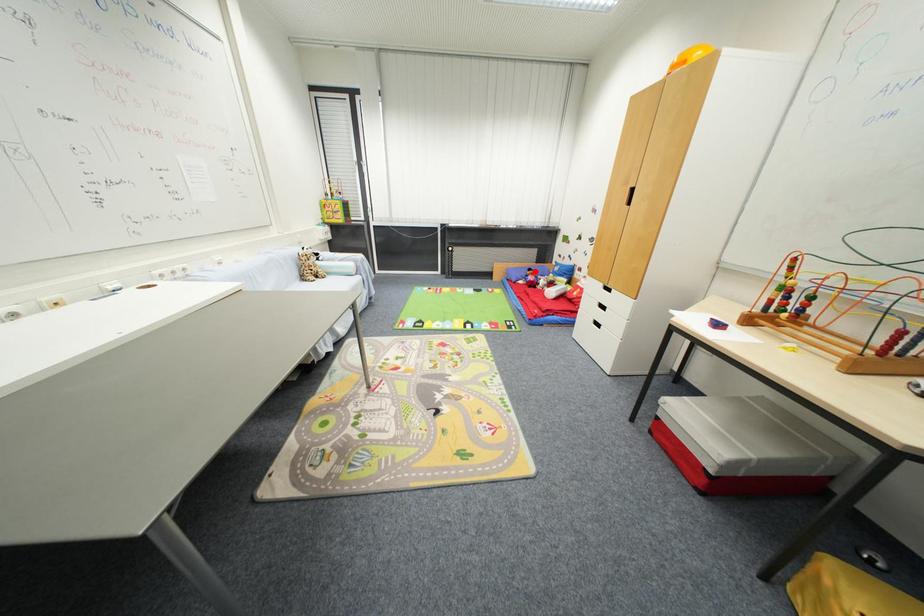
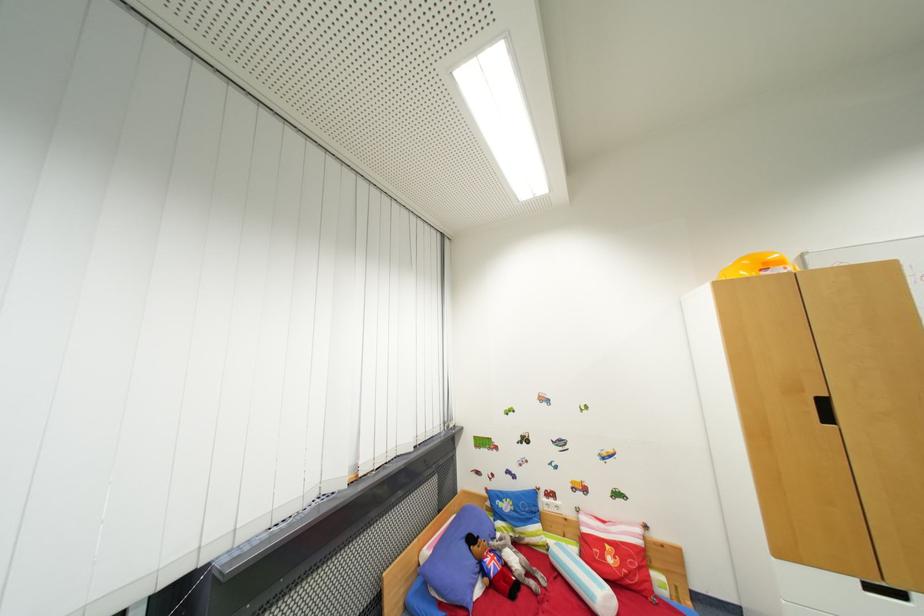
Locate, in the second image, the point that corresponds to the highlighted location in the first image.

(477, 541)